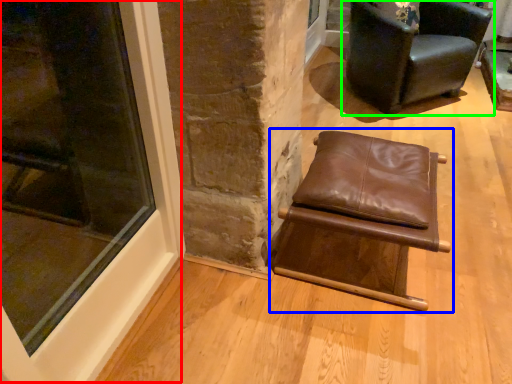
Question: Considering the real-world distances, which object is closest to window (highlighted by a red box)? chair (highlighted by a blue box) or chair (highlighted by a green box).

Choices:
 (A) chair
 (B) chair

Answer: (A)